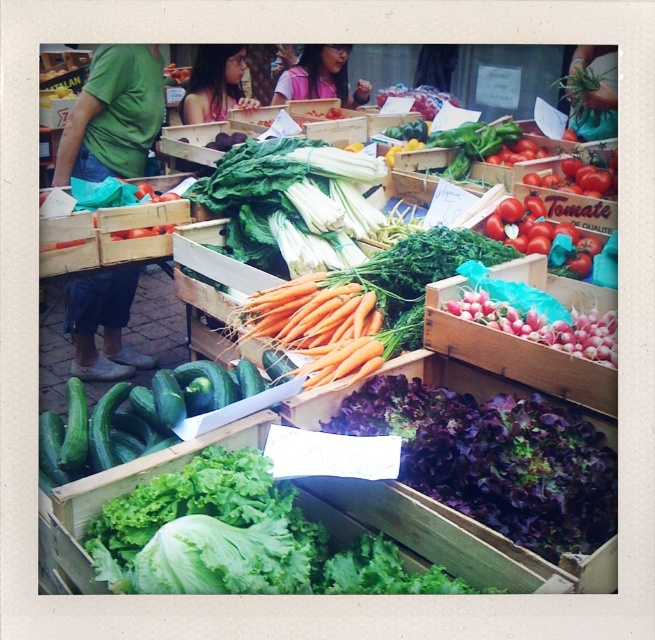
Question: Which point is closer to the camera?

Choices:
 (A) green smooth cucumbers at center
 (B) pink radish at right
 (C) green leafy lettuce at center
 (D) red matte tomatoes at upper right

Answer: (C)

Question: Can you confirm if pink radish at right is smaller than ripe red tomatoes at right?

Choices:
 (A) yes
 (B) no

Answer: (B)

Question: Is orange matte carrots at center above red matte tomatoes at upper right?

Choices:
 (A) no
 (B) yes

Answer: (A)

Question: Considering the real-world distances, which object is closest to the orange matte carrots at center?

Choices:
 (A) pink radish at right
 (B) green smooth cucumbers at center
 (C) green leafy lettuce at center
 (D) purple leafy lettuce at center

Answer: (B)

Question: Which object appears farthest from the camera in this image?

Choices:
 (A) red matte tomatoes at upper right
 (B) pink radish at right
 (C) ripe red tomatoes at right
 (D) purple leafy lettuce at center

Answer: (A)

Question: Is pink radish at right to the right of red matte tomatoes at upper right from the viewer's perspective?

Choices:
 (A) no
 (B) yes

Answer: (A)